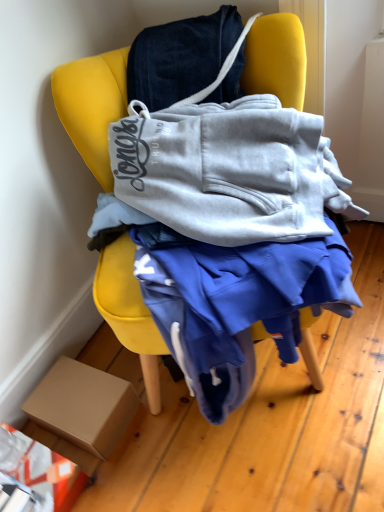
At what (x,y) coordinates should I click in order to perform the action: click on vacant space situated above brown cardboard box at lower left (from a real-world perspective). Please return your answer as a coordinate pair (x, y). Looking at the image, I should click on (75, 394).